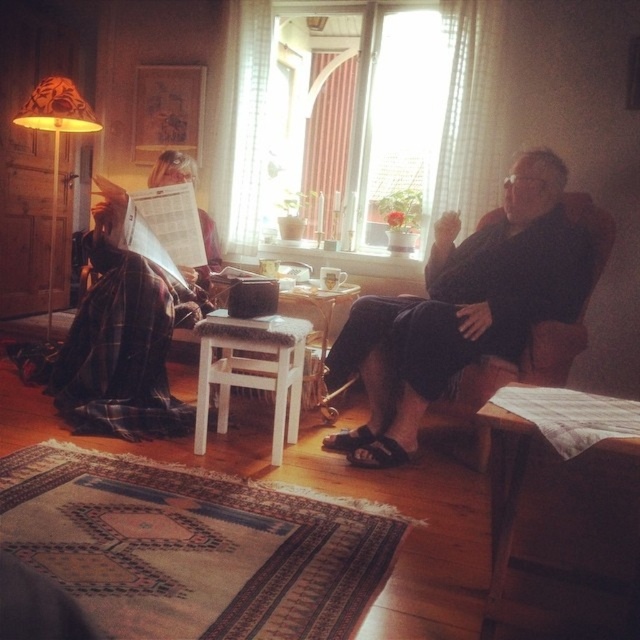
You are a guest in this living room and want to sit on the white wooden stool at center. To reach it, you must walk through the translucent fabric window at center. Is this possible?

The white wooden stool at center is behind the translucent fabric window at center, so you cannot walk through the translucent fabric window at center to reach the white wooden stool at center because the stool is already behind it.

You are standing at the entrance of the living room and want to sit on the dark blue fabric chair at center. Which direction should you walk to reach it?

The dark blue fabric chair at center is located at point 0.484 on the x and 0.723 on the y coordinates, so you should walk towards the center of the room to reach it.